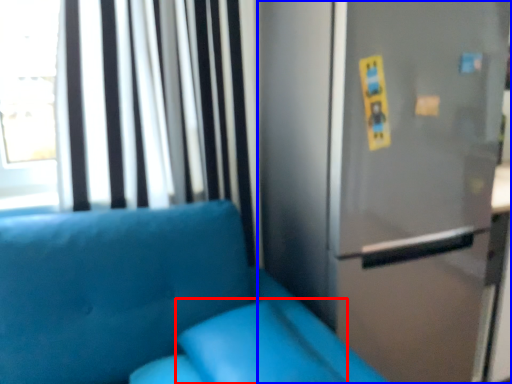
Question: Among these objects, which one is farthest to the camera, pillow (highlighted by a red box) or fridge (highlighted by a blue box)?

Choices:
 (A) pillow
 (B) fridge

Answer: (B)